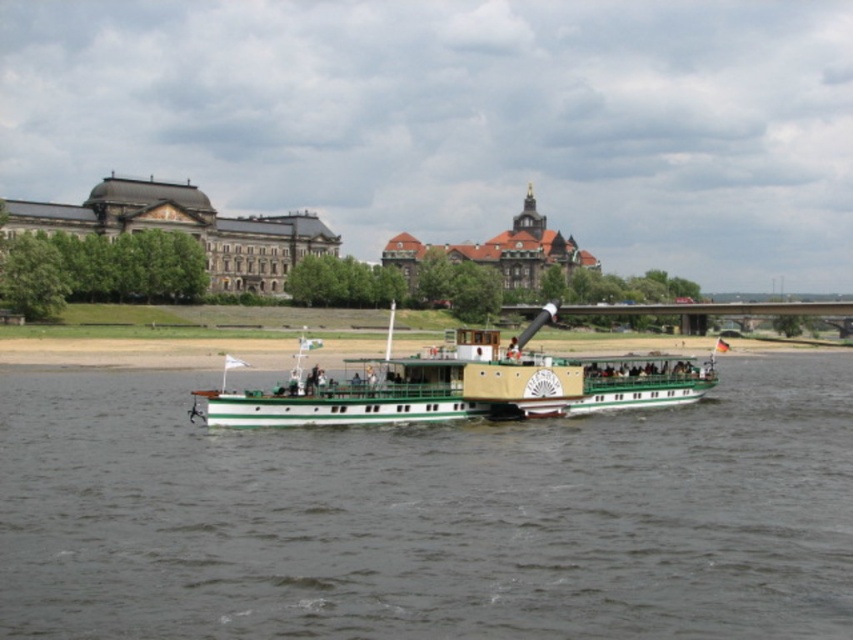
In the scene shown: Is green matte boat at center wider than green polished wood boat at center?

Correct, the width of green matte boat at center exceeds that of green polished wood boat at center.

Consider the image. How distant is green matte boat at center from green polished wood boat at center?

A distance of 14.42 meters exists between green matte boat at center and green polished wood boat at center.

Is point (195, 490) positioned behind point (457, 358)?

No, (195, 490) is in front of (457, 358).

The image size is (853, 640). I want to click on green matte boat at center, so click(428, 516).